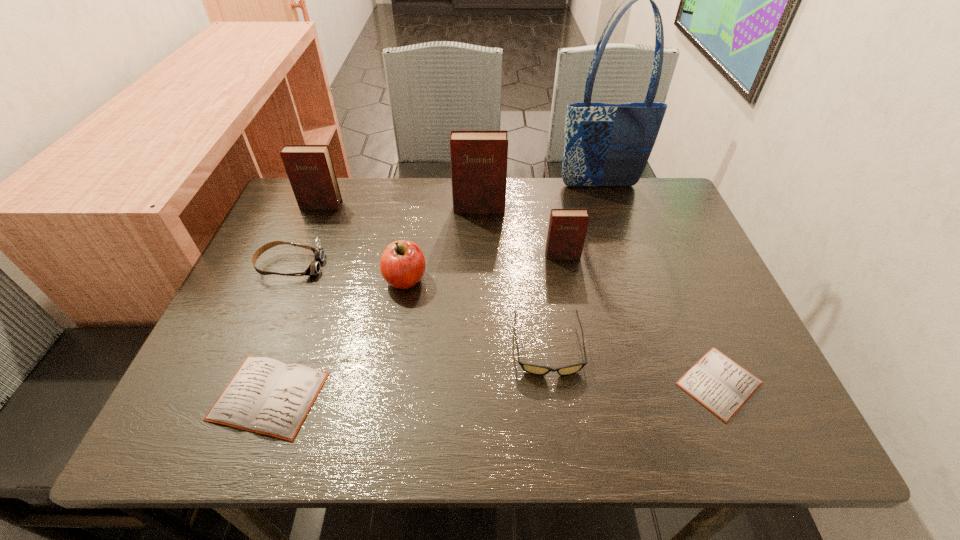
The height and width of the screenshot is (540, 960). I want to click on object identified as the second closest to the tallest object, so click(567, 229).

Identify which object is the third closest to the fourth shortest object. Please provide its 2D coordinates. Your answer should be formatted as a tuple, i.e. [(x, y)], where the tuple contains the x and y coordinates of a point satisfying the conditions above.

[(266, 396)]

Select which diary appears as the fourth closest to the second shortest diary. Please provide its 2D coordinates. Your answer should be formatted as a tuple, i.e. [(x, y)], where the tuple contains the x and y coordinates of a point satisfying the conditions above.

[(721, 385)]

Choose which diary is the fifth nearest neighbor to the shopping bag. Please provide its 2D coordinates. Your answer should be formatted as a tuple, i.e. [(x, y)], where the tuple contains the x and y coordinates of a point satisfying the conditions above.

[(266, 396)]

You are a GUI agent. You are given a task and a screenshot of the screen. Output one action in this format:
    pyautogui.click(x=<x>, y=<y>)
    Task: Click on the reddish-brown diary that is the closest to the sunglasses
    The height and width of the screenshot is (540, 960).
    Given the screenshot: What is the action you would take?
    pyautogui.click(x=567, y=229)

Find the location of a particular element. This screenshot has height=540, width=960. reddish-brown diary that stands as the second closest to the third diary from left to right is located at coordinates coord(310,170).

The height and width of the screenshot is (540, 960). I want to click on free location that satisfies the following two spatial constraints: 1. on the front cover of the third farthest diary; 2. on the left side of the rightmost diary, so click(x=587, y=383).

Where is `free location that satisfies the following two spatial constraints: 1. on the front-facing side of the shortest object; 2. on the left side of the third shortest object`? free location that satisfies the following two spatial constraints: 1. on the front-facing side of the shortest object; 2. on the left side of the third shortest object is located at coordinates tap(553, 383).